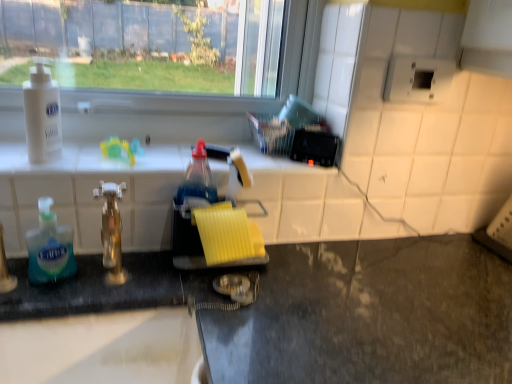
You are a GUI agent. You are given a task and a screenshot of the screen. Output one action in this format:
    pyautogui.click(x=<x>, y=<y>)
    Task: Click on the vacant area that lies between yellow sponge at center and gold metallic faucet at center
    The height and width of the screenshot is (384, 512).
    Given the screenshot: What is the action you would take?
    pyautogui.click(x=150, y=275)